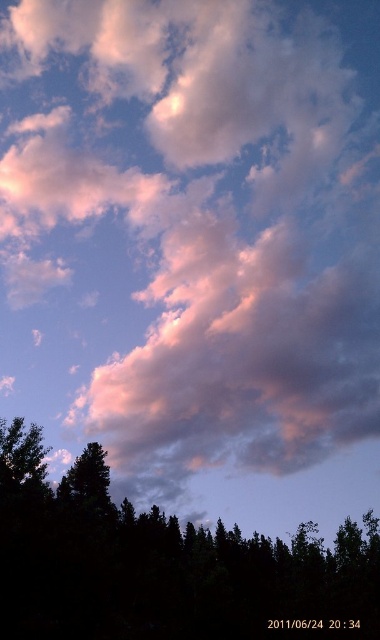
Question: Which of the following is the farthest from the observer?

Choices:
 (A) (237, 531)
 (B) (74, 506)

Answer: (A)

Question: Is dark green leafy tree at bottom positioned behind dark green textured tree at lower left?

Choices:
 (A) no
 (B) yes

Answer: (A)

Question: Can you confirm if dark green leafy tree at bottom is positioned to the right of dark green textured tree at lower left?

Choices:
 (A) no
 (B) yes

Answer: (B)

Question: Which point is closer to the camera taking this photo?

Choices:
 (A) (88, 488)
 (B) (155, 589)

Answer: (B)

Question: Which point is closer to the camera?

Choices:
 (A) (188, 609)
 (B) (88, 454)

Answer: (A)

Question: Is dark green leafy tree at bottom thinner than dark green textured tree at lower left?

Choices:
 (A) yes
 (B) no

Answer: (B)